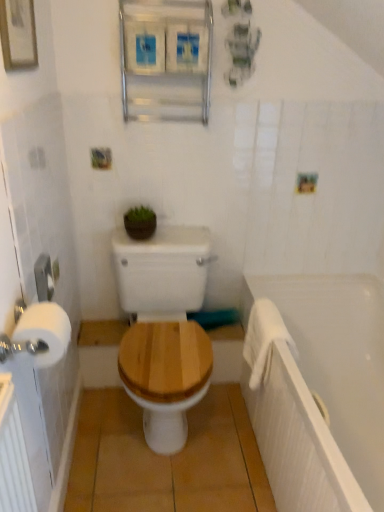
The width and height of the screenshot is (384, 512). I want to click on vacant point above white soft towel at right (from a real-world perspective), so click(270, 313).